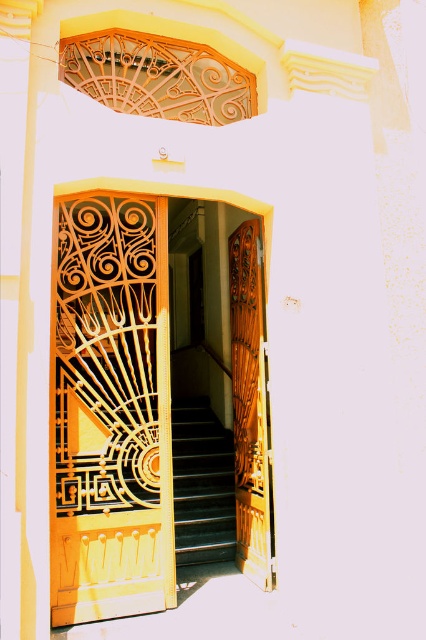
Question: Does golden wrought iron door at center have a lesser width compared to wooden carved door at center?

Choices:
 (A) yes
 (B) no

Answer: (B)

Question: Which point appears closest to the camera in this image?

Choices:
 (A) pos(249,340)
 (B) pos(98,476)

Answer: (B)

Question: Does golden wrought iron door at center appear under black glossy stairs at center?

Choices:
 (A) yes
 (B) no

Answer: (B)

Question: Among these objects, which one is nearest to the camera?

Choices:
 (A) golden wrought iron door at center
 (B) wooden carved door at center

Answer: (A)

Question: Is golden wrought iron door at center positioned in front of black glossy stairs at center?

Choices:
 (A) yes
 (B) no

Answer: (A)

Question: Among these objects, which one is nearest to the camera?

Choices:
 (A) black glossy stairs at center
 (B) wooden carved door at center

Answer: (B)